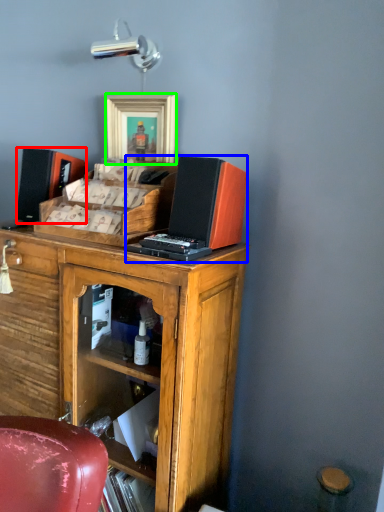
Question: Which is nearer to the speaker (highlighted by a red box)? computer (highlighted by a blue box) or picture frame (highlighted by a green box).

Choices:
 (A) computer
 (B) picture frame

Answer: (B)